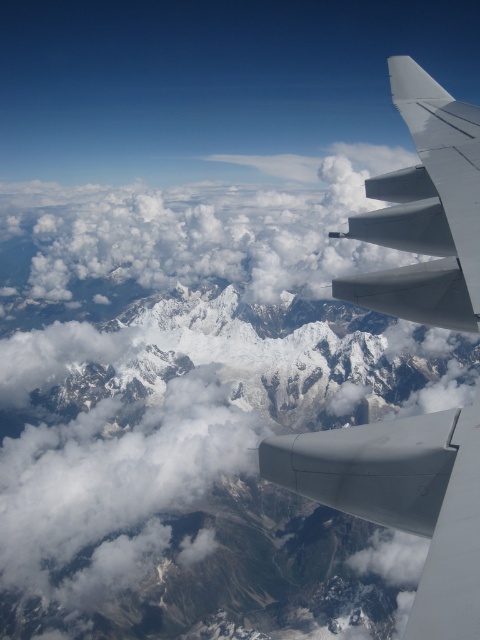
Question: Which is farther from the gray matte engine at center?

Choices:
 (A) white fluffy cloud at center
 (B) snowy rocky mountain range at center
 (C) matte gray wing at right

Answer: (A)

Question: Is snowy rocky mountain range at center further to camera compared to white matte wing at upper right?

Choices:
 (A) no
 (B) yes

Answer: (B)

Question: Which of the following is the farthest from the observer?

Choices:
 (A) (425, 262)
 (B) (432, 614)
 (C) (72, 568)

Answer: (C)

Question: Does white fluffy cloud at center have a greater width compared to gray matte engine at center?

Choices:
 (A) yes
 (B) no

Answer: (A)

Question: Is matte gray wing at right positioned behind white matte wing at upper right?

Choices:
 (A) no
 (B) yes

Answer: (A)

Question: Based on their relative distances, which object is nearer to the matte gray wing at right?

Choices:
 (A) snowy rocky mountain range at center
 (B) gray matte engine at center

Answer: (B)